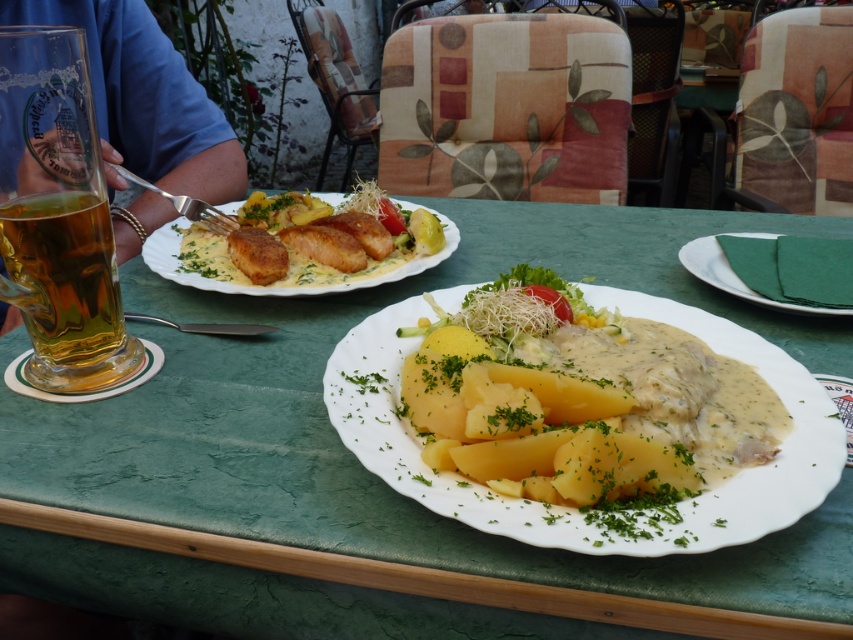
Question: Which is farther from the yellow matte potatoes at center?

Choices:
 (A) green paper napkin at right
 (B) green leafy vegetable at center
 (C) translucent glass beer at left

Answer: (C)

Question: Does white plate at center have a lesser width compared to yellow matte potatoes at center?

Choices:
 (A) no
 (B) yes

Answer: (A)

Question: Among these points, which one is nearest to the camera?

Choices:
 (A) (585, 449)
 (B) (503, 291)

Answer: (A)

Question: Observing the image, what is the correct spatial positioning of translucent glass beer at left in reference to green paper napkin at right?

Choices:
 (A) above
 (B) below

Answer: (B)

Question: Based on their relative distances, which object is nearer to the golden-brown crispy chicken at center?

Choices:
 (A) white plate at center
 (B) green paper napkin at right
 (C) translucent glass beer at left
 (D) yellow matte potatoes at center

Answer: (A)

Question: Is white plate at center smaller than yellow matte potatoes at center?

Choices:
 (A) no
 (B) yes

Answer: (A)